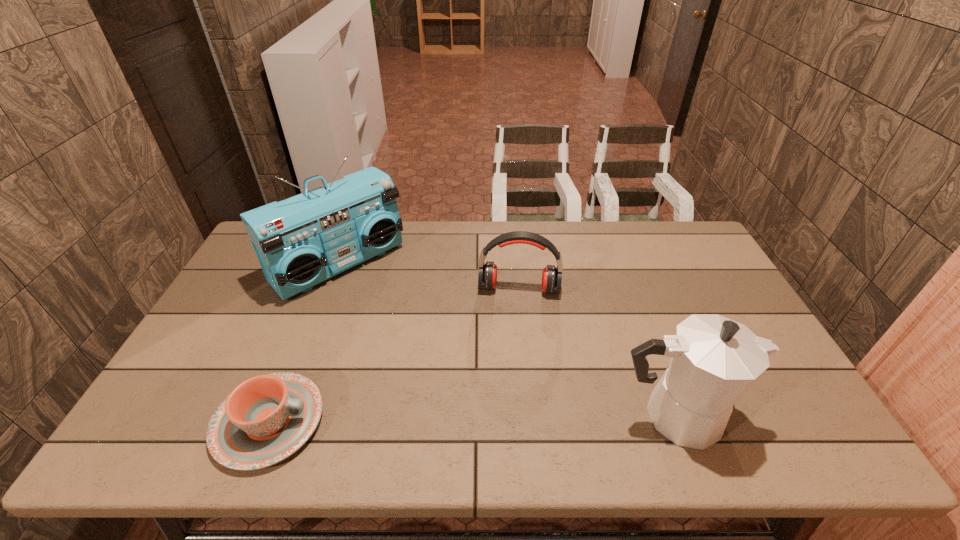
Where is `empty space between the radio receiver and the third object from left to right`? empty space between the radio receiver and the third object from left to right is located at coordinates (429, 276).

Where is `vacant space that's between the coffeepot and the radio receiver`? Image resolution: width=960 pixels, height=540 pixels. vacant space that's between the coffeepot and the radio receiver is located at coordinates tap(506, 340).

At what (x,y) coordinates should I click in order to perform the action: click on the third closest object to the second shortest object. Please return your answer as a coordinate pair (x, y). Image resolution: width=960 pixels, height=540 pixels. Looking at the image, I should click on (267, 418).

You are a GUI agent. You are given a task and a screenshot of the screen. Output one action in this format:
    pyautogui.click(x=<x>, y=<y>)
    Task: Click on the object that can be found as the third closest to the rightmost object
    This screenshot has height=540, width=960.
    Given the screenshot: What is the action you would take?
    pyautogui.click(x=267, y=418)

Identify the location of blank area in the image that satisfies the following two spatial constraints: 1. on the front side of the coffeepot; 2. at the spout of the radio receiver. (283, 416).

Where is `free space that satisfies the following two spatial constraints: 1. on the front side of the radio receiver; 2. on the left side of the third tallest object`? free space that satisfies the following two spatial constraints: 1. on the front side of the radio receiver; 2. on the left side of the third tallest object is located at coordinates [x=331, y=289].